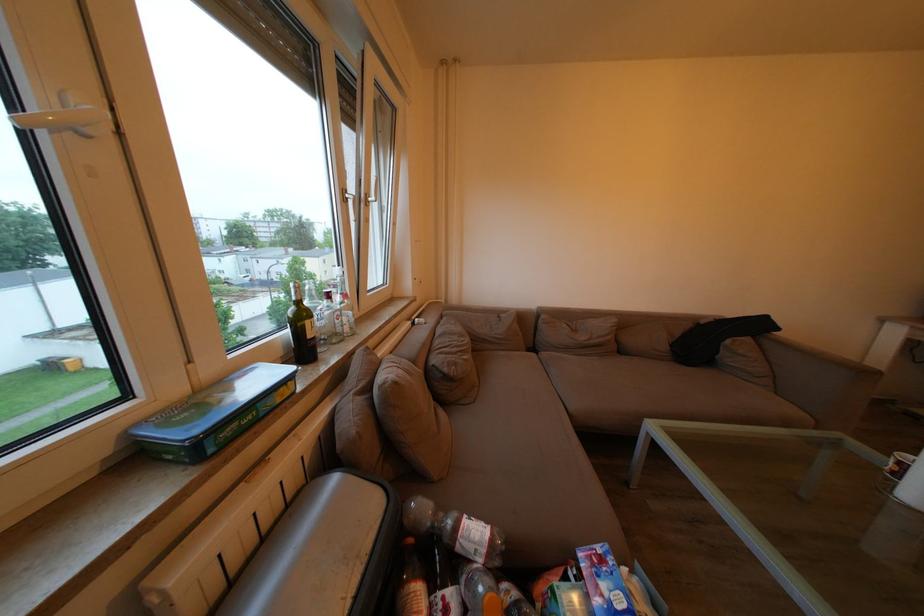
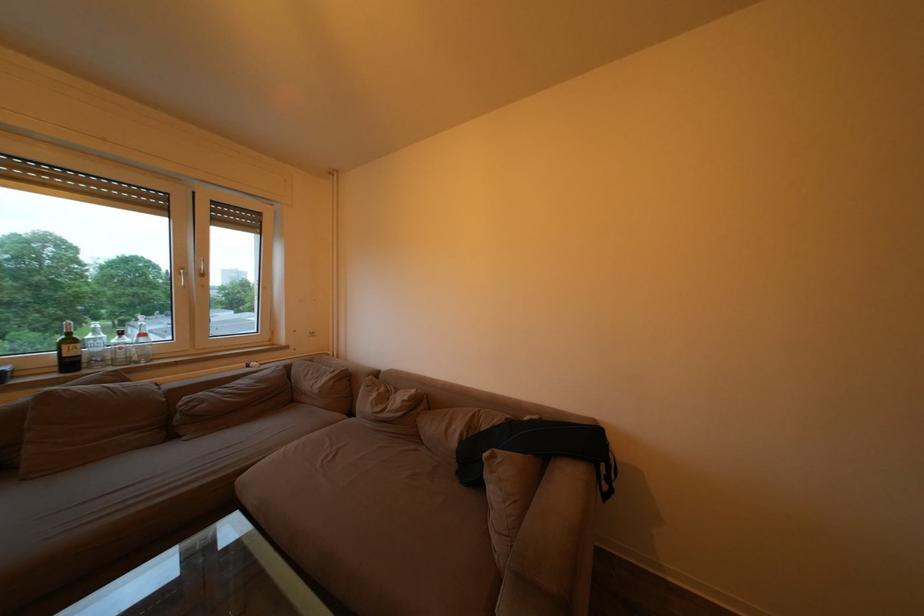
Find the pixel in the second image that matches (672,352) in the first image.

(463, 448)